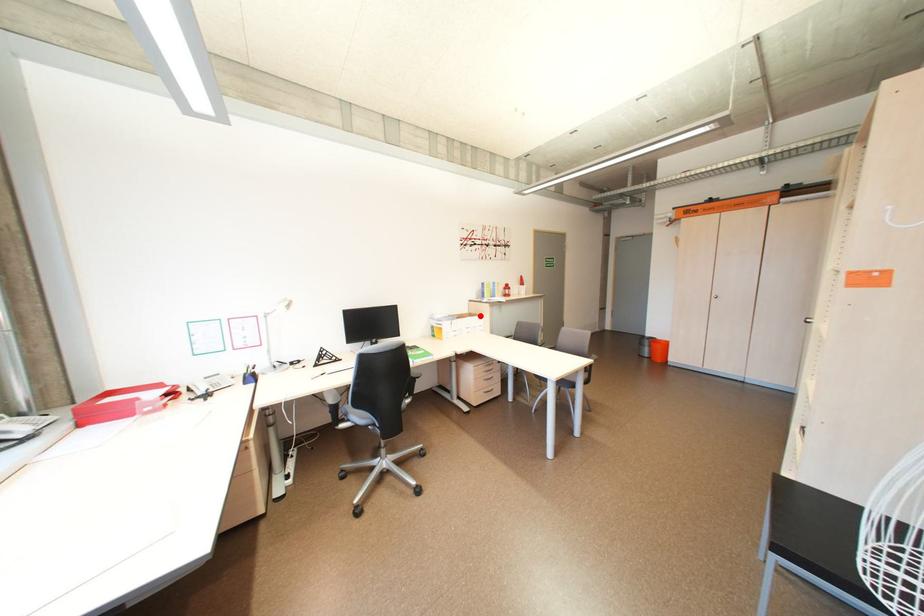
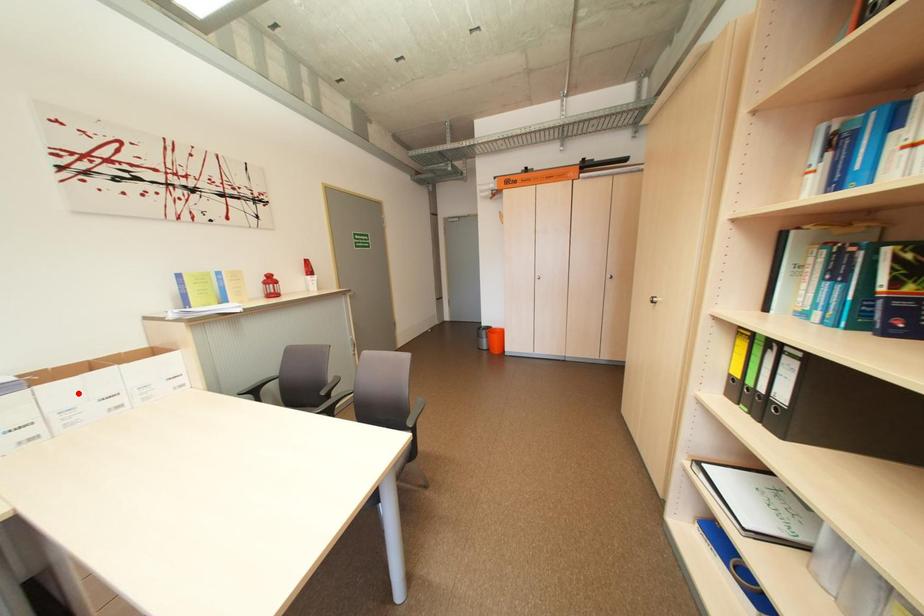
I am providing you with two images of the same scene from different viewpoints. A red point is marked on the first image and another point is marked on the second image. Do the highlighted points in image1 and image2 indicate the same real-world spot?

No